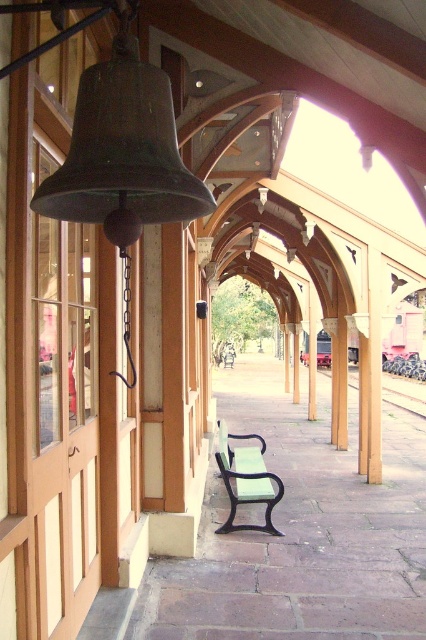
You are a traveler waiting for your train at the station. You want to sit down on the green matte bench at center while keeping a safe distance from the metal train track at center. Is the bench wide enough for you to sit without being too close to the track?

The green matte bench at center has a lesser width compared to metal train track at center, so the bench is narrower than the track. Since the bench is narrower, it might not provide enough space to sit safely away from the metal train track at center. Consider moving further away from the track to ensure safety.